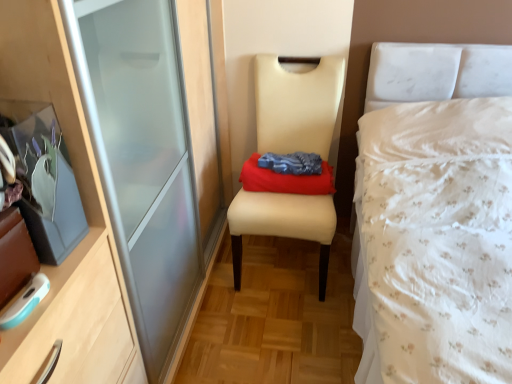
Question: From the image's perspective, would you say beige leather chair at center is shown under red cotton cloth at center?

Choices:
 (A) yes
 (B) no

Answer: (A)

Question: Are beige leather chair at center and red cotton cloth at center far apart?

Choices:
 (A) yes
 (B) no

Answer: (B)

Question: Does beige leather chair at center have a lesser width compared to red cotton cloth at center?

Choices:
 (A) no
 (B) yes

Answer: (A)

Question: Can you confirm if beige leather chair at center is positioned to the left of red cotton cloth at center?

Choices:
 (A) no
 (B) yes

Answer: (B)

Question: Considering the relative sizes of beige leather chair at center and red cotton cloth at center in the image provided, is beige leather chair at center shorter than red cotton cloth at center?

Choices:
 (A) no
 (B) yes

Answer: (A)

Question: Is beige leather chair at center to the left or to the right of white floral fabric bed at right in the image?

Choices:
 (A) right
 (B) left

Answer: (B)

Question: Looking at the image, does beige leather chair at center seem bigger or smaller compared to white floral fabric bed at right?

Choices:
 (A) small
 (B) big

Answer: (A)

Question: Is beige leather chair at center in front of or behind white floral fabric bed at right in the image?

Choices:
 (A) behind
 (B) front

Answer: (A)

Question: Is beige leather chair at center situated inside white floral fabric bed at right or outside?

Choices:
 (A) inside
 (B) outside

Answer: (B)

Question: Is point (269, 170) closer or farther from the camera than point (325, 122)?

Choices:
 (A) closer
 (B) farther

Answer: (A)

Question: Is red cotton cloth at center in front of or behind beige leather chair at center in the image?

Choices:
 (A) front
 (B) behind

Answer: (B)

Question: From their relative heights in the image, would you say red cotton cloth at center is taller or shorter than beige leather chair at center?

Choices:
 (A) tall
 (B) short

Answer: (B)

Question: From a real-world perspective, is red cotton cloth at center physically located above or below beige leather chair at center?

Choices:
 (A) above
 (B) below

Answer: (A)

Question: Is white floral fabric bed at right wider or thinner than beige leather chair at center?

Choices:
 (A) thin
 (B) wide

Answer: (B)

Question: From a real-world perspective, is white floral fabric bed at right physically located above or below beige leather chair at center?

Choices:
 (A) above
 (B) below

Answer: (A)